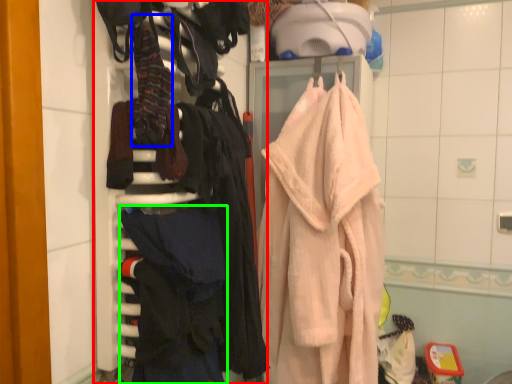
Question: Considering the real-world distances, which object is farthest from closet (highlighted by a red box)? clothing (highlighted by a blue box) or clothing (highlighted by a green box)?

Choices:
 (A) clothing
 (B) clothing

Answer: (A)